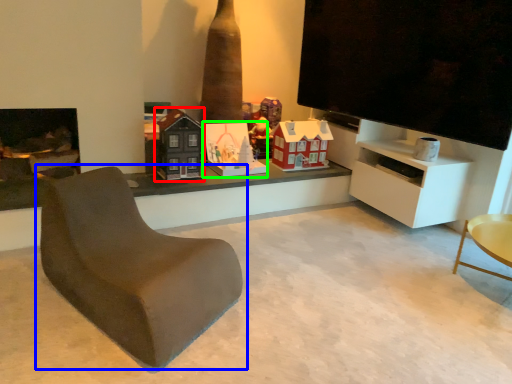
Question: Based on their relative distances, which object is nearer to toy (highlighted by a red box)? Choose from chair (highlighted by a blue box) and toy (highlighted by a green box).

Choices:
 (A) chair
 (B) toy

Answer: (B)